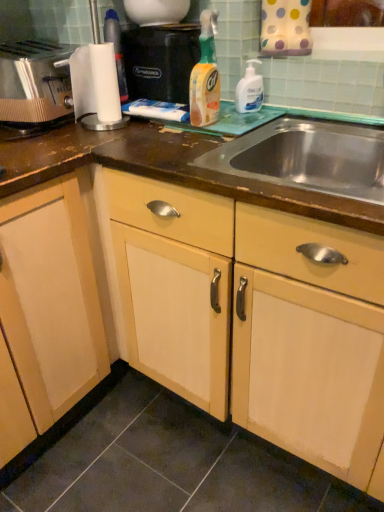
Identify the location of free space on the front side of brushed metal toaster at left. This screenshot has height=512, width=384. (57, 138).